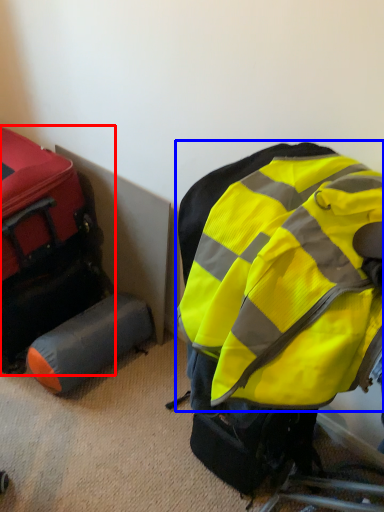
Question: Which of the following is the closest to the observer, luggage and bags (highlighted by a red box) or backpack (highlighted by a blue box)?

Choices:
 (A) luggage and bags
 (B) backpack

Answer: (B)